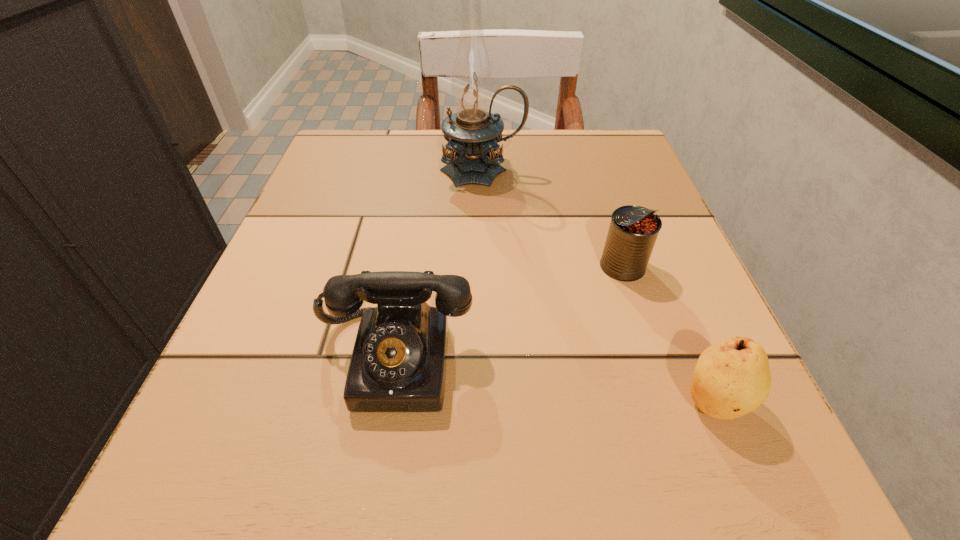
This screenshot has height=540, width=960. Identify the location of object positioned at the left edge. (398, 364).

Locate an element on the screen. can present at the right edge is located at coordinates (633, 231).

Image resolution: width=960 pixels, height=540 pixels. What are the coordinates of `pear present at the right edge` in the screenshot? It's located at (732, 378).

The height and width of the screenshot is (540, 960). In the image, there is a desktop. In order to click on vacant space at the far edge in this screenshot , I will do `click(520, 130)`.

You are a GUI agent. You are given a task and a screenshot of the screen. Output one action in this format:
    pyautogui.click(x=<x>, y=<y>)
    Task: Click on the vacant space at the near edge
    
    Given the screenshot: What is the action you would take?
    pyautogui.click(x=493, y=459)

In the image, there is a desktop. At what (x,y) coordinates should I click in order to perform the action: click on vacant space at the left edge. Please return your answer as a coordinate pair (x, y). This screenshot has height=540, width=960. Looking at the image, I should click on (338, 271).

Identify the location of blank area at the right edge. (595, 210).

In the image, there is a desktop. At what (x,y) coordinates should I click in order to perform the action: click on vacant space at the far left corner. Please return your answer as a coordinate pair (x, y). The width and height of the screenshot is (960, 540). Looking at the image, I should click on (347, 139).

Locate an element on the screen. This screenshot has width=960, height=540. vacant space at the near left corner is located at coordinates (152, 502).

Image resolution: width=960 pixels, height=540 pixels. In the image, there is a desktop. In order to click on free region at the far right corner in this screenshot , I will do `click(600, 154)`.